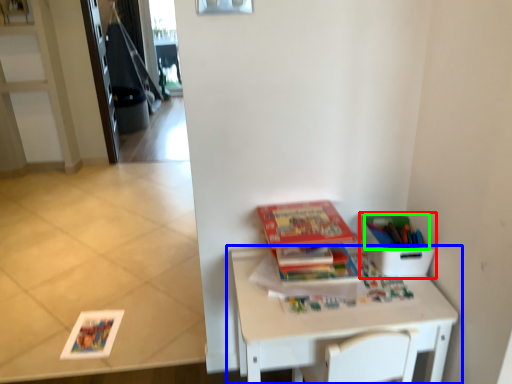
Question: Based on their relative distances, which object is farther from cardboard box (highlighted by a red box)? Choose from table (highlighted by a blue box) and book (highlighted by a green box).

Choices:
 (A) table
 (B) book

Answer: (A)